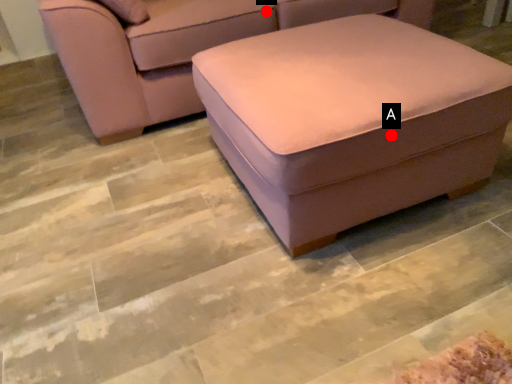
Question: Two points are circled on the image, labeled by A and B beside each circle. Which point is closer to the camera?

Choices:
 (A) A is closer
 (B) B is closer

Answer: (A)